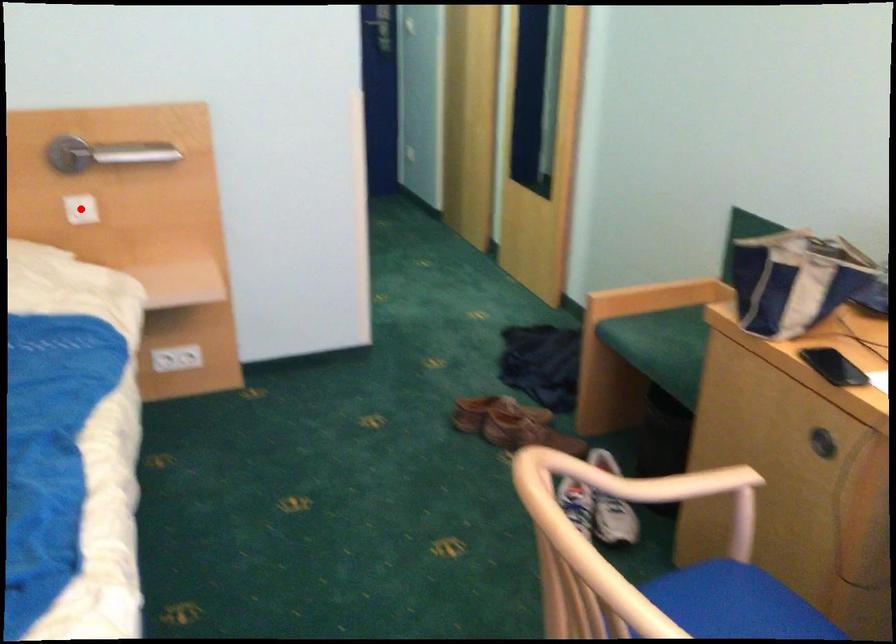
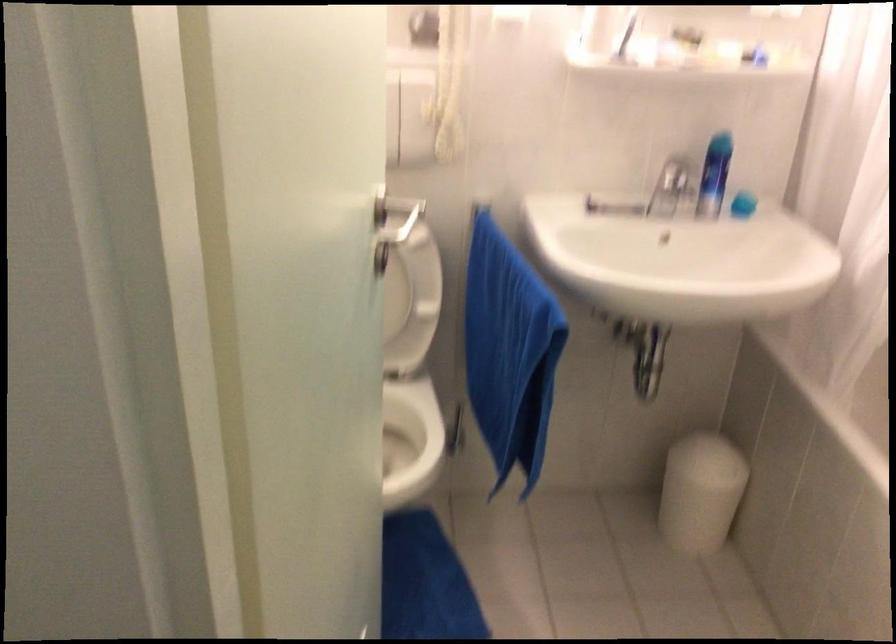
Question: I am providing you with two images of the same scene from different viewpoints. A red point is marked on the first image. At the location where the point appears in image 1, is it still visible in image 2?

Choices:
 (A) Yes
 (B) No

Answer: (B)